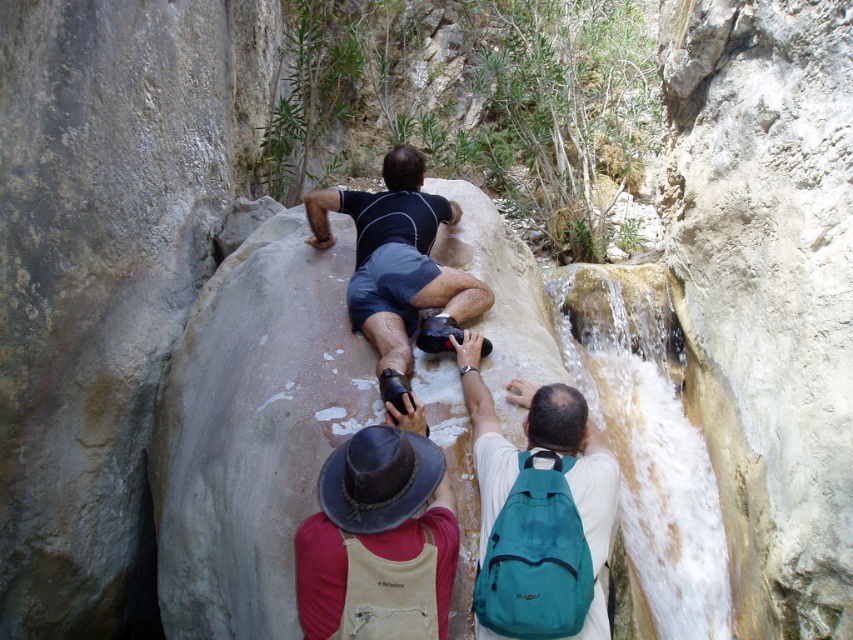
You are part of a hiking group and need to locate two items in the canyon scene. The items are the teal fabric backpack at center and the brown leather hat at upper center. Which item is positioned to the right of the other?

The teal fabric backpack at center is to the right of the brown leather hat at upper center.

You are one of the climbers in the canyon. You need to reach the teal fabric backpack at center to grab your water bottle. Can you easily access it without moving the dark blue shorts at center?

The teal fabric backpack at center is in front of dark blue shorts at center, so it can be accessed easily without moving the dark blue shorts at center.